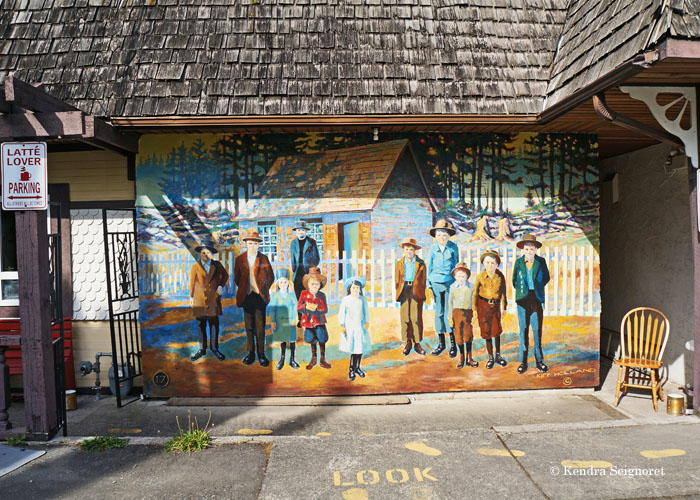
Identify the location of beam. The image size is (700, 500). (24, 265).